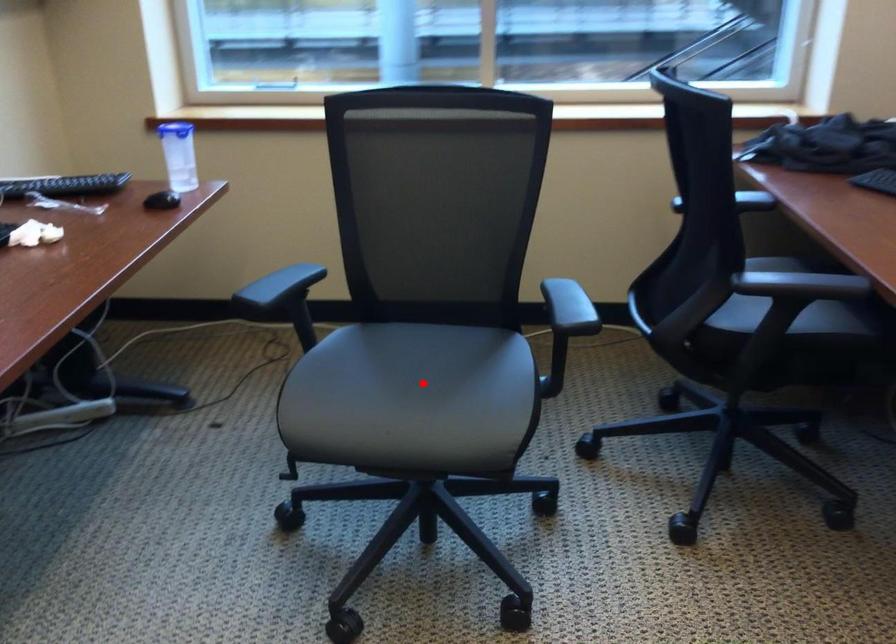
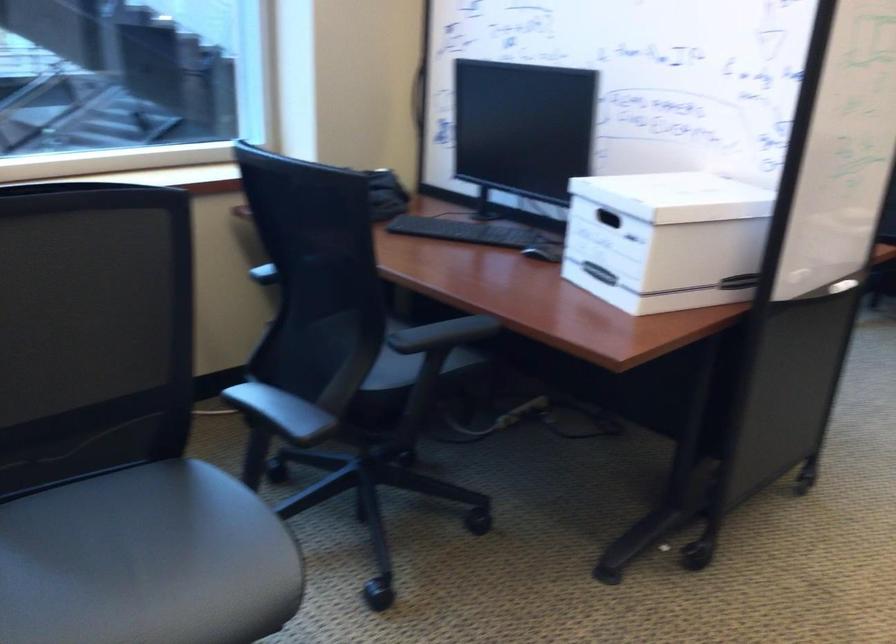
Question: I am providing you with two images of the same scene from different viewpoints. A red point is shown in image1. For the corresponding object point in image2, is it positioned nearer or farther from the camera?

Choices:
 (A) Nearer
 (B) Farther

Answer: (A)